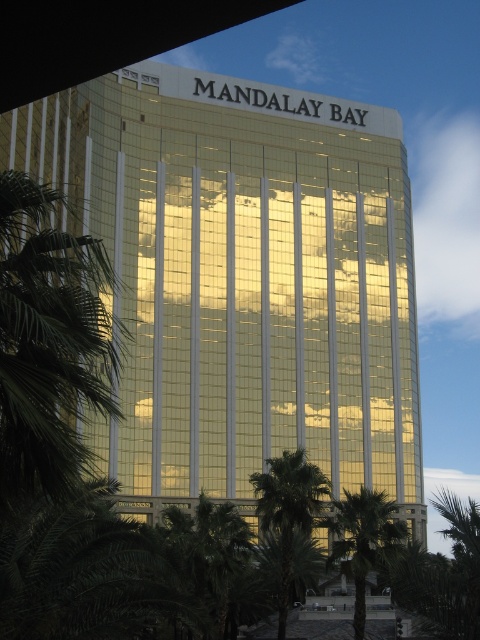
Consider the image. Can you confirm if green leafy palm tree at lower center is taller than green leafy palm tree at center?

No.

Between green leafy palm tree at lower center and green leafy palm tree at center, which one has more height?

With more height is green leafy palm tree at center.

Locate an element on the screen. The image size is (480, 640). green leafy palm tree at lower center is located at coordinates (362, 540).

This screenshot has width=480, height=640. In order to click on green leafy palm tree at lower center in this screenshot , I will do `click(362, 540)`.

Does gold reflective glass building at center have a larger size compared to green leafy palm tree at lower center?

Indeed, gold reflective glass building at center has a larger size compared to green leafy palm tree at lower center.

Consider the image. Can you confirm if gold reflective glass building at center is positioned to the left of green leafy palm tree at lower center?

Yes, gold reflective glass building at center is to the left of green leafy palm tree at lower center.

Between point (242, 305) and point (371, 550), which one is positioned in front?

Positioned in front is point (371, 550).

This screenshot has height=640, width=480. Identify the location of gold reflective glass building at center. tap(241, 280).

Image resolution: width=480 pixels, height=640 pixels. What do you see at coordinates (241, 280) in the screenshot?
I see `gold reflective glass building at center` at bounding box center [241, 280].

From the picture: Can you confirm if gold reflective glass building at center is positioned above green leafy palm tree at center?

Indeed, gold reflective glass building at center is positioned over green leafy palm tree at center.

Between point (320, 356) and point (313, 492), which one is positioned in front?

Point (313, 492) is in front.

This screenshot has height=640, width=480. In order to click on gold reflective glass building at center in this screenshot , I will do `click(241, 280)`.